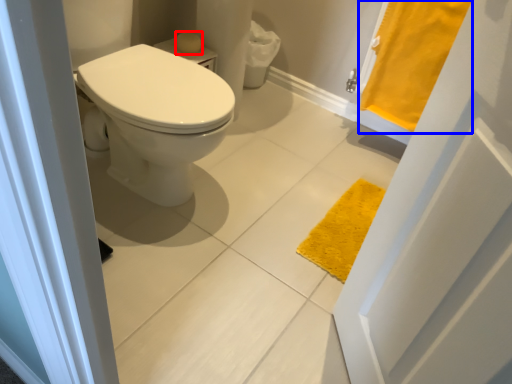
Question: Which of the following is the closest to the observer, soap (highlighted by a red box) or bath towel (highlighted by a blue box)?

Choices:
 (A) soap
 (B) bath towel

Answer: (B)